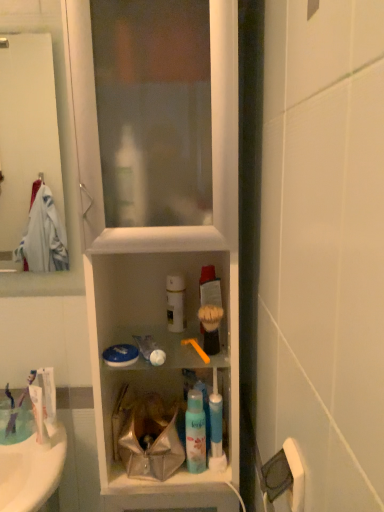
Question: Is white plastic cabinet at center facing towards white matte spray can at center?

Choices:
 (A) yes
 (B) no

Answer: (A)

Question: Considering the relative sizes of white plastic cabinet at center and white matte spray can at center in the image provided, is white plastic cabinet at center shorter than white matte spray can at center?

Choices:
 (A) no
 (B) yes

Answer: (A)

Question: Would you consider white plastic cabinet at center to be distant from white matte spray can at center?

Choices:
 (A) yes
 (B) no

Answer: (B)

Question: Considering the relative sizes of white plastic cabinet at center and white matte spray can at center in the image provided, is white plastic cabinet at center bigger than white matte spray can at center?

Choices:
 (A) yes
 (B) no

Answer: (A)

Question: Does white plastic cabinet at center appear on the left side of white matte spray can at center?

Choices:
 (A) yes
 (B) no

Answer: (A)

Question: Can you confirm if white plastic cabinet at center is taller than white matte spray can at center?

Choices:
 (A) no
 (B) yes

Answer: (B)

Question: Is white glossy tube at left, positioned as the 1th toothpaste in back-to-front order, turned away from white matte spray can at center?

Choices:
 (A) yes
 (B) no

Answer: (B)

Question: Could you tell me if white glossy tube at left, positioned as the 1th toothpaste in back-to-front order, is turned towards white matte spray can at center?

Choices:
 (A) no
 (B) yes

Answer: (A)

Question: Is white glossy tube at left, which is counted as the second toothpaste, starting from the front, positioned before white matte spray can at center?

Choices:
 (A) yes
 (B) no

Answer: (B)

Question: Does white glossy tube at left, which is counted as the second toothpaste, starting from the front, have a lesser height compared to white matte spray can at center?

Choices:
 (A) yes
 (B) no

Answer: (B)

Question: Considering the relative positions of white glossy tube at left, positioned as the 1th toothpaste in back-to-front order, and white matte spray can at center in the image provided, is white glossy tube at left, positioned as the 1th toothpaste in back-to-front order, behind white matte spray can at center?

Choices:
 (A) no
 (B) yes

Answer: (B)

Question: From the image's perspective, is white glossy tube at left, positioned as the 1th toothpaste in back-to-front order, under white matte spray can at center?

Choices:
 (A) no
 (B) yes

Answer: (B)

Question: Is translucent plastic mouthwash at center next to white matte toothpaste at lower left, the 1th toothpaste when ordered from front to back?

Choices:
 (A) yes
 (B) no

Answer: (B)